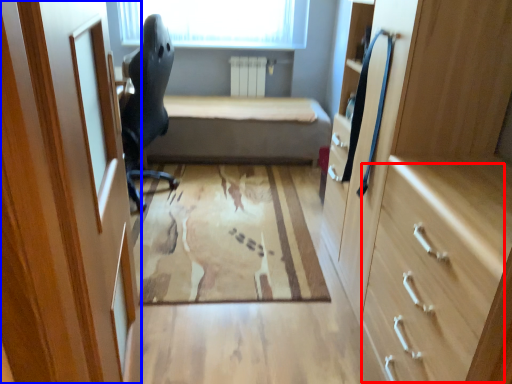
Question: Which object appears closest to the camera in this image, drawer (highlighted by a red box) or door (highlighted by a blue box)?

Choices:
 (A) drawer
 (B) door

Answer: (B)